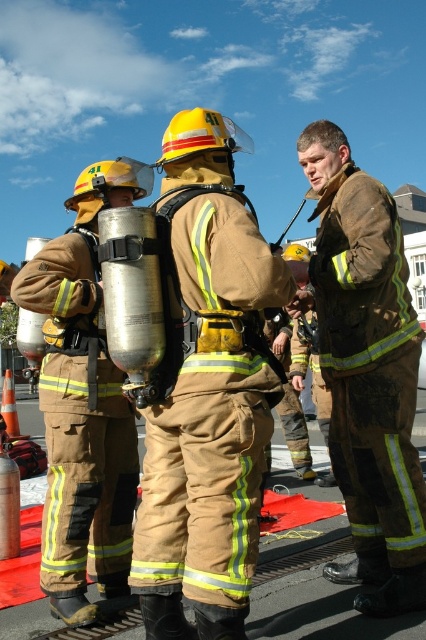
Question: Which object appears closest to the camera in this image?

Choices:
 (A) matte black fireman at left
 (B) matte khaki uniform at center
 (C) brown leather jacket at center

Answer: (B)

Question: Does brown leather jacket at center have a greater width compared to matte black fireman at left?

Choices:
 (A) no
 (B) yes

Answer: (A)

Question: Which of the following is the farthest from the observer?

Choices:
 (A) (x=408, y=323)
 (B) (x=224, y=177)

Answer: (A)

Question: Among these objects, which one is farthest from the camera?

Choices:
 (A) brown leather jacket at center
 (B) matte black fireman at left

Answer: (A)

Question: Is matte khaki uniform at center above matte black fireman at left?

Choices:
 (A) no
 (B) yes

Answer: (B)

Question: Is matte khaki uniform at center below brown leather jacket at center?

Choices:
 (A) no
 (B) yes

Answer: (B)